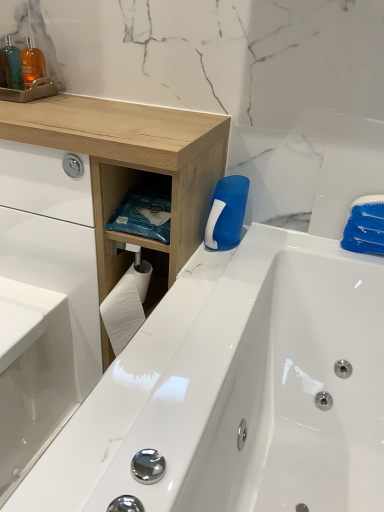
Question: Is translucent plastic bottle at upper left spatially inside white glossy sink at lower left, or outside of it?

Choices:
 (A) inside
 (B) outside

Answer: (B)

Question: Is translucent plastic bottle at upper left bigger or smaller than white glossy sink at lower left?

Choices:
 (A) small
 (B) big

Answer: (A)

Question: Which is nearer to the blue plastic cleaning brush at upper right?

Choices:
 (A) translucent plastic bottle at upper left
 (B) natural wood counter at upper left
 (C) white glossy sink at lower left

Answer: (B)

Question: Which object is positioned farthest from the natural wood counter at upper left?

Choices:
 (A) translucent plastic bottle at upper left
 (B) blue plastic cleaning brush at upper right
 (C) white glossy sink at lower left

Answer: (A)